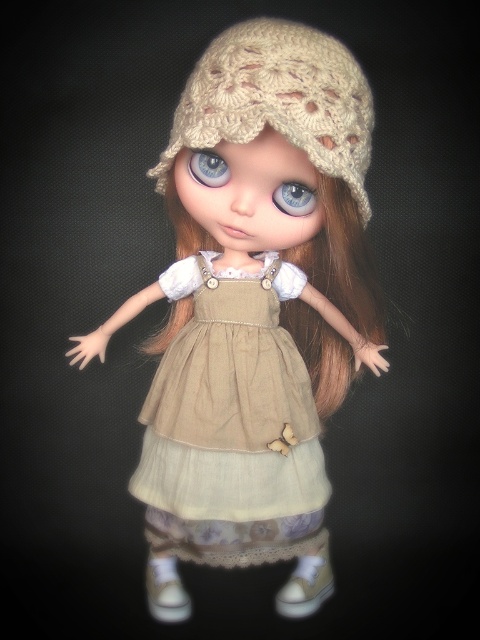
Consider the image. Who is higher up, beige knitted hat at center or blue glass eye at center?

Result: beige knitted hat at center

Is beige knitted hat at center further to camera compared to blue glass eye at center?

No, beige knitted hat at center is in front of blue glass eye at center.

Where is `beige knitted hat at center`? This screenshot has height=640, width=480. beige knitted hat at center is located at coordinates (277, 99).

Is point (163, 436) positioned behind point (160, 170)?

Yes.

Who is more forward, (319, 452) or (264, 20)?

Point (264, 20) is in front.

The width and height of the screenshot is (480, 640). I want to click on beige cotton dress at center, so click(x=231, y=436).

Between beige knitted hat at upper center and blue glass eye at center, which one has more height?

With more height is beige knitted hat at upper center.

What are the coordinates of `beige knitted hat at upper center` in the screenshot? It's located at (253, 312).

Who is more forward, (140, 492) or (204, 182)?

Point (204, 182) is in front.

You are a GUI agent. You are given a task and a screenshot of the screen. Output one action in this format:
    pyautogui.click(x=<x>, y=<y>)
    Task: Click on the beige knitted hat at upper center
    The image size is (480, 640).
    Given the screenshot: What is the action you would take?
    pyautogui.click(x=253, y=312)